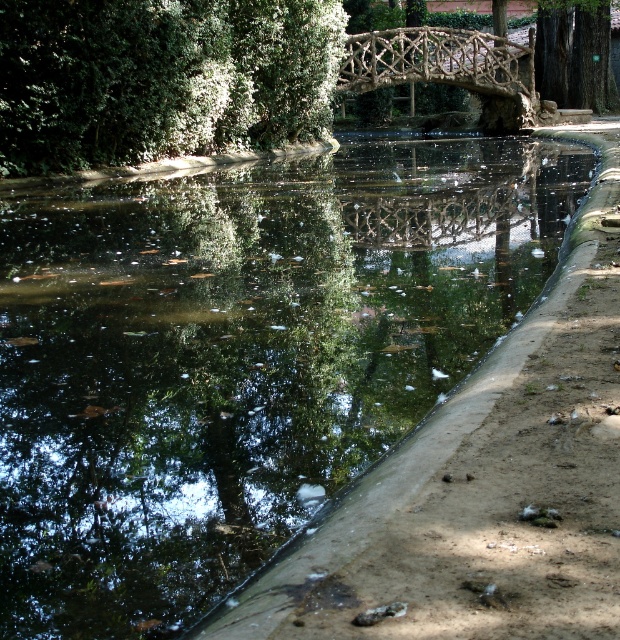
Question: Which of these objects is positioned farthest from the green leafy tree at upper left?

Choices:
 (A) natural wood bridge at center
 (B) green rough bark tree at upper right

Answer: (B)

Question: Is green leafy tree at upper left to the right of green rough bark tree at upper right from the viewer's perspective?

Choices:
 (A) no
 (B) yes

Answer: (A)

Question: Does natural wood bridge at center lie behind green rough bark tree at upper right?

Choices:
 (A) no
 (B) yes

Answer: (A)

Question: Among these points, which one is nearest to the camera?

Choices:
 (A) (186, 122)
 (B) (541, 81)

Answer: (A)

Question: Estimate the real-world distances between objects in this image. Which object is farther from the natural wood bridge at center?

Choices:
 (A) green rough bark tree at upper right
 (B) green leafy tree at upper left

Answer: (B)

Question: Is green leafy tree at upper left smaller than natural wood bridge at center?

Choices:
 (A) no
 (B) yes

Answer: (B)